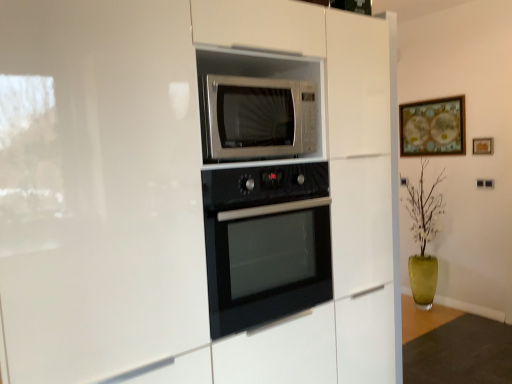
Identify the location of wooden framed map at upper right, which is the second picture frame from right to left. (433, 127).

I want to click on black glass oven at center, so click(266, 243).

What is the approximate height of satin silver microwave at center?

It is 13.12 inches.

You are a GUI agent. You are given a task and a screenshot of the screen. Output one action in this format:
    pyautogui.click(x=<x>, y=<y>)
    Task: Click on the wooden picture frame at upper right, the 1th picture frame when ordered from front to back
    The width and height of the screenshot is (512, 384).
    Given the screenshot: What is the action you would take?
    pyautogui.click(x=482, y=146)

Can you confirm if wooden picture frame at upper right, which appears as the 2th picture frame when viewed from the left, is shorter than wooden framed map at upper right, arranged as the first picture frame when viewed from the left?

Yes.

From a real-world perspective, is wooden picture frame at upper right, the 1th picture frame when ordered from right to left, on wooden framed map at upper right, which is the second picture frame from right to left?

Actually, wooden picture frame at upper right, the 1th picture frame when ordered from right to left, is physically below wooden framed map at upper right, which is the second picture frame from right to left, in the real world.

Is wooden picture frame at upper right, the 1th picture frame when ordered from right to left, oriented towards wooden framed map at upper right, arranged as the first picture frame when viewed from the left?

No, wooden picture frame at upper right, the 1th picture frame when ordered from right to left, is not oriented towards wooden framed map at upper right, arranged as the first picture frame when viewed from the left.

Are wooden picture frame at upper right, the 1th picture frame when ordered from front to back, and wooden framed map at upper right, the 1th picture frame viewed from the back, beside each other?

They are not placed beside each other.

Where is `picture frame that is the 1st one when counting backward from the satin silver microwave at center`? Image resolution: width=512 pixels, height=384 pixels. picture frame that is the 1st one when counting backward from the satin silver microwave at center is located at coordinates (482, 146).

Looking at the image, does satin silver microwave at center seem bigger or smaller compared to wooden picture frame at upper right, the 1th picture frame when ordered from front to back?

Clearly, satin silver microwave at center is larger in size than wooden picture frame at upper right, the 1th picture frame when ordered from front to back.

Does point (234, 129) lie in front of point (489, 150)?

Yes.

Is wooden picture frame at upper right, which appears as the 2th picture frame when viewed from the left, to the left of satin silver microwave at center from the viewer's perspective?

No, wooden picture frame at upper right, which appears as the 2th picture frame when viewed from the left, is not to the left of satin silver microwave at center.

From the image's perspective, is wooden picture frame at upper right, the 1th picture frame when ordered from front to back, over satin silver microwave at center?

Yes, from the image's perspective, wooden picture frame at upper right, the 1th picture frame when ordered from front to back, is above satin silver microwave at center.

From a real-world perspective, which is physically above, wooden picture frame at upper right, the 1th picture frame when ordered from right to left, or satin silver microwave at center?

satin silver microwave at center is physically above.

Can you tell me how much satin silver microwave at center and black glass oven at center differ in facing direction?

They differ by 0.0159 degrees in their facing directions.

Is point (257, 133) closer to viewer compared to point (273, 269)?

Yes.

Can you see satin silver microwave at center touching black glass oven at center?

No, satin silver microwave at center is not with black glass oven at center.

From a real-world perspective, between satin silver microwave at center and black glass oven at center, who is vertically lower?

black glass oven at center is physically lower.

From the image's perspective, which is below, black glass oven at center or satin silver microwave at center?

From the image's view, black glass oven at center is below.

Considering the relative positions of black glass oven at center and satin silver microwave at center in the image provided, is black glass oven at center behind satin silver microwave at center?

No, it is not.

Considering the positions of point (306, 243) and point (262, 152), is point (306, 243) closer or farther from the camera than point (262, 152)?

Point (306, 243) is farther from the camera than point (262, 152).

Is black glass oven at center located outside satin silver microwave at center?

Absolutely, black glass oven at center is external to satin silver microwave at center.

Can wooden picture frame at upper right, which appears as the 2th picture frame when viewed from the left, be found inside wooden framed map at upper right, the 1th picture frame viewed from the back?

Definitely not — wooden picture frame at upper right, which appears as the 2th picture frame when viewed from the left, is not inside wooden framed map at upper right, the 1th picture frame viewed from the back.

Locate an element on the screen. The image size is (512, 384). picture frame on the left of wooden picture frame at upper right, the 1th picture frame when ordered from right to left is located at coordinates 433,127.

From a real-world perspective, does wooden framed map at upper right, the 1th picture frame viewed from the back, stand above wooden picture frame at upper right, the second picture frame when ordered from back to front?

Yes, from a real-world perspective, wooden framed map at upper right, the 1th picture frame viewed from the back, is on top of wooden picture frame at upper right, the second picture frame when ordered from back to front.

Which object is thinner, wooden framed map at upper right, which is the second picture frame from right to left, or wooden picture frame at upper right, which appears as the 2th picture frame when viewed from the left?

Thinner between the two is wooden picture frame at upper right, which appears as the 2th picture frame when viewed from the left.

Based on the photo, what's the angular difference between black glass oven at center and wooden framed map at upper right, which is the second picture frame from right to left,'s facing directions?

black glass oven at center and wooden framed map at upper right, which is the second picture frame from right to left, are facing 89.4 degrees away from each other.

From the image's perspective, relative to wooden framed map at upper right, which is the second picture frame from right to left, is black glass oven at center above or below?

From the image's perspective, black glass oven at center appears below wooden framed map at upper right, which is the second picture frame from right to left.

From a real-world perspective, is black glass oven at center beneath wooden framed map at upper right, which appears as the second picture frame when viewed from the front?

Yes, from a real-world perspective, black glass oven at center is under wooden framed map at upper right, which appears as the second picture frame when viewed from the front.

Which object is wider, black glass oven at center or wooden framed map at upper right, arranged as the first picture frame when viewed from the left?

black glass oven at center is wider.

Identify the location of picture frame lying above the wooden picture frame at upper right, the second picture frame when ordered from back to front (from the image's perspective). This screenshot has height=384, width=512. (433, 127).

Find the location of a particular element. The image size is (512, 384). microwave oven to the left of wooden picture frame at upper right, which appears as the 2th picture frame when viewed from the left is located at coordinates (260, 117).

Considering their positions, is wooden picture frame at upper right, the 1th picture frame when ordered from front to back, positioned further to black glass oven at center than wooden framed map at upper right, which appears as the second picture frame when viewed from the front?

wooden picture frame at upper right, the 1th picture frame when ordered from front to back, lies further to black glass oven at center than the other object.

Estimate the real-world distances between objects in this image. Which object is closer to black glass oven at center, satin silver microwave at center or wooden framed map at upper right, arranged as the first picture frame when viewed from the left?

satin silver microwave at center is positioned closer to the anchor black glass oven at center.

In the scene shown: Based on their spatial positions, is wooden picture frame at upper right, the 1th picture frame when ordered from front to back, or wooden framed map at upper right, arranged as the first picture frame when viewed from the left, closer to satin silver microwave at center?

Based on the image, wooden picture frame at upper right, the 1th picture frame when ordered from front to back, appears to be nearer to satin silver microwave at center.

From the image, which object appears to be farther from black glass oven at center, satin silver microwave at center or wooden picture frame at upper right, the 1th picture frame when ordered from front to back?

The object further to black glass oven at center is wooden picture frame at upper right, the 1th picture frame when ordered from front to back.

Considering their positions, is satin silver microwave at center positioned closer to wooden framed map at upper right, arranged as the first picture frame when viewed from the left, than wooden picture frame at upper right, the 1th picture frame when ordered from front to back?

Among the two, wooden picture frame at upper right, the 1th picture frame when ordered from front to back, is located nearer to wooden framed map at upper right, arranged as the first picture frame when viewed from the left.

Which object lies further to the anchor point satin silver microwave at center, wooden framed map at upper right, which is the second picture frame from right to left, or black glass oven at center?

wooden framed map at upper right, which is the second picture frame from right to left, is further to satin silver microwave at center.

Considering their positions, is satin silver microwave at center positioned further to wooden picture frame at upper right, the second picture frame when ordered from back to front, than black glass oven at center?

satin silver microwave at center lies further to wooden picture frame at upper right, the second picture frame when ordered from back to front, than the other object.

From the image, which object appears to be farther from wooden framed map at upper right, which is the second picture frame from right to left, wooden picture frame at upper right, the second picture frame when ordered from back to front, or black glass oven at center?

black glass oven at center is further to wooden framed map at upper right, which is the second picture frame from right to left.

The height and width of the screenshot is (384, 512). Find the location of `microwave oven between black glass oven at center and wooden picture frame at upper right, the 1th picture frame when ordered from right to left, from front to back`. microwave oven between black glass oven at center and wooden picture frame at upper right, the 1th picture frame when ordered from right to left, from front to back is located at coordinates (260, 117).

Where is `picture frame between black glass oven at center and wooden framed map at upper right, arranged as the first picture frame when viewed from the left, in the front-back direction`? picture frame between black glass oven at center and wooden framed map at upper right, arranged as the first picture frame when viewed from the left, in the front-back direction is located at coordinates (482, 146).

This screenshot has height=384, width=512. Find the location of `picture frame between satin silver microwave at center and wooden framed map at upper right, which is the second picture frame from right to left, from front to back`. picture frame between satin silver microwave at center and wooden framed map at upper right, which is the second picture frame from right to left, from front to back is located at coordinates (482, 146).

Image resolution: width=512 pixels, height=384 pixels. In order to click on microwave oven between black glass oven at center and wooden framed map at upper right, which appears as the second picture frame when viewed from the front, in the front-back direction in this screenshot , I will do `click(260, 117)`.